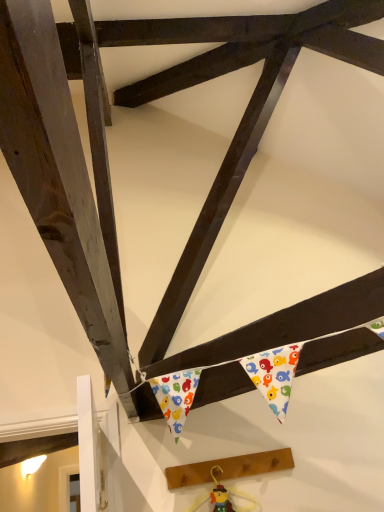
Measure the distance between wooden toy at center and camera.

wooden toy at center is 1.74 meters away from camera.

The width and height of the screenshot is (384, 512). I want to click on wooden toy at center, so click(x=224, y=497).

This screenshot has width=384, height=512. Describe the element at coordinates (224, 497) in the screenshot. I see `wooden toy at center` at that location.

Measure the distance between point (235, 462) and camera.

The depth of point (235, 462) is 1.82 meters.

This screenshot has height=512, width=384. What do you see at coordinates (229, 468) in the screenshot? I see `wooden plank at lower center` at bounding box center [229, 468].

Locate an element on the screen. The image size is (384, 512). wooden plank at lower center is located at coordinates point(229,468).

Where is `wooden toy at center`? wooden toy at center is located at coordinates (224, 497).

In the image, is wooden plank at lower center on the left side or the right side of wooden toy at center?

wooden plank at lower center is to the right of wooden toy at center.

Is wooden plank at lower center further to camera compared to wooden toy at center?

Yes, wooden plank at lower center is further from the camera.

Between point (241, 469) and point (258, 503), which one is positioned in front?

The point (258, 503) is closer to the camera.

From the image's perspective, does wooden plank at lower center appear lower than wooden toy at center?

No, from the image's perspective, wooden plank at lower center is not beneath wooden toy at center.

In the scene shown: From a real-world perspective, between wooden plank at lower center and wooden toy at center, who is vertically higher?

wooden plank at lower center, from a real-world perspective.

Is wooden plank at lower center wider or thinner than wooden toy at center?

Clearly, wooden plank at lower center has more width compared to wooden toy at center.

Can you confirm if wooden plank at lower center is shorter than wooden toy at center?

Correct, wooden plank at lower center is not as tall as wooden toy at center.

From the picture: Is wooden plank at lower center bigger than wooden toy at center?

Yes.

Is wooden plank at lower center positioned beyond the bounds of wooden toy at center?

wooden plank at lower center lies outside wooden toy at center's area.

Is wooden plank at lower center far from wooden toy at center?

No, there isn't a large distance between wooden plank at lower center and wooden toy at center.

Is wooden plank at lower center aimed at wooden toy at center?

No, wooden plank at lower center is not aimed at wooden toy at center.

Can you tell me how much wooden plank at lower center and wooden toy at center differ in facing direction?

1.14 degrees.

You are a GUI agent. You are given a task and a screenshot of the screen. Output one action in this format:
    pyautogui.click(x=<x>, y=<y>)
    Task: Click on the plank above the wooden toy at center (from a real-world perspective)
    Image resolution: width=384 pixels, height=512 pixels.
    Given the screenshot: What is the action you would take?
    pyautogui.click(x=229, y=468)

Does wooden toy at center appear on the left side of wooden plank at lower center?

Indeed, wooden toy at center is positioned on the left side of wooden plank at lower center.

In the image, is wooden toy at center positioned in front of or behind wooden plank at lower center?

wooden toy at center is in front of wooden plank at lower center.

Considering the points (258, 505) and (263, 464), which point is behind, point (258, 505) or point (263, 464)?

The point (263, 464) is farther.

From the image's perspective, is wooden toy at center located above or below wooden plank at lower center?

Based on their image positions, wooden toy at center is located beneath wooden plank at lower center.

From a real-world perspective, is wooden toy at center positioned under wooden plank at lower center based on gravity?

Yes.

In terms of width, does wooden toy at center look wider or thinner when compared to wooden plank at lower center?

wooden toy at center is thinner than wooden plank at lower center.

Considering the relative sizes of wooden toy at center and wooden plank at lower center in the image provided, is wooden toy at center taller than wooden plank at lower center?

Correct, wooden toy at center is much taller as wooden plank at lower center.

Is wooden toy at center bigger or smaller than wooden plank at lower center?

wooden toy at center is smaller than wooden plank at lower center.

Would you say wooden toy at center contains wooden plank at lower center?

Definitely not — wooden plank at lower center is not inside wooden toy at center.

Is wooden toy at center far away from wooden plank at lower center?

Actually, wooden toy at center and wooden plank at lower center are a little close together.

Is wooden toy at center facing towards wooden plank at lower center?

Yes, wooden toy at center faces towards wooden plank at lower center.

Based on the photo, how many degrees apart are the facing directions of wooden toy at center and wooden plank at lower center?

1.14 degrees.

The image size is (384, 512). I want to click on plank that is behind the wooden toy at center, so click(229, 468).

You are a GUI agent. You are given a task and a screenshot of the screen. Output one action in this format:
    pyautogui.click(x=<x>, y=<y>)
    Task: Click on the plank above the wooden toy at center (from a real-world perspective)
    Image resolution: width=384 pixels, height=512 pixels.
    Given the screenshot: What is the action you would take?
    pyautogui.click(x=229, y=468)

This screenshot has width=384, height=512. I want to click on toy below the wooden plank at lower center (from the image's perspective), so click(224, 497).